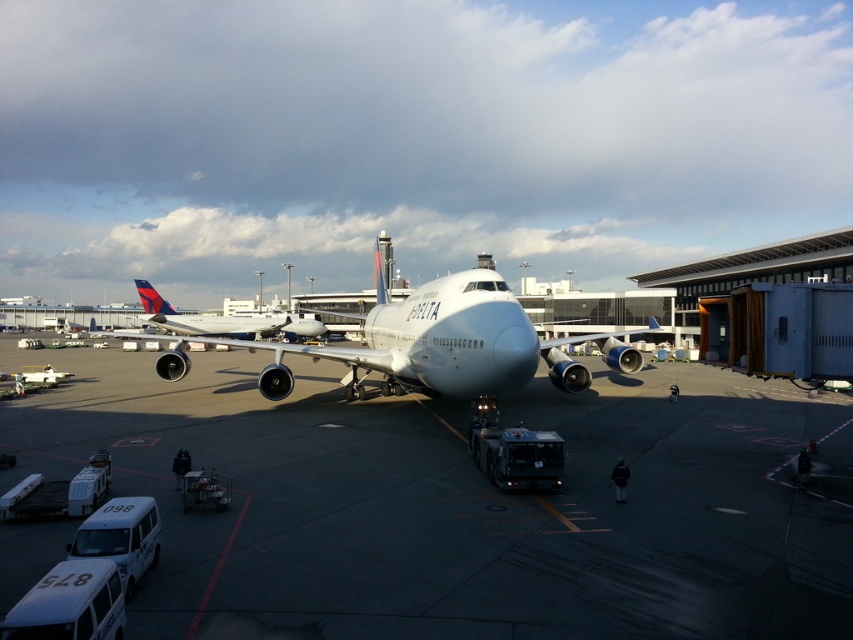
Where is the white smooth tarmac at center located in the image?

The white smooth tarmac at center is located at point (460, 504) in the image.

You are a pilot preparing to taxi the matte white airplane at center to the runway. The white smooth tarmac at center is the path you need to take. Considering the height difference between the two, will the airplane have any difficulty moving over the tarmac?

The white smooth tarmac at center has a lesser height compared to the matte white airplane at center, so the airplane will not have any difficulty moving over the tarmac since the tarmac is lower and provides a smooth surface for taxiing.

You are a pilot who just landed the white glossy airplane at center. You need to taxi to the gate, but you must ensure there is enough space on the white smooth tarmac at center for your plane. Based on the scene, can you proceed?

The white smooth tarmac at center occupies less space than the white glossy airplane at center. Therefore, there might not be enough space for the airplane to taxi safely, so it is advisable to proceed with caution or seek further guidance from ground control.